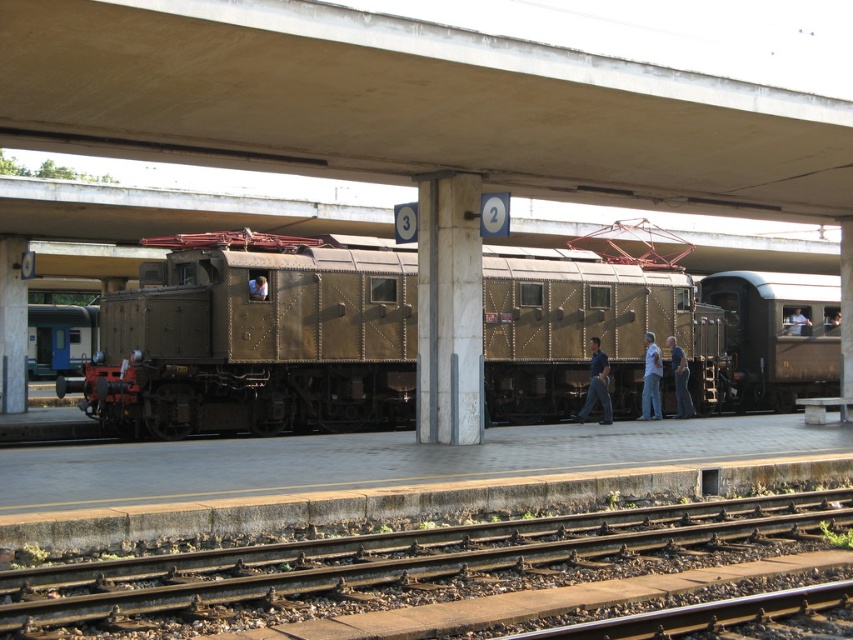
Question: Is rusty metal train at center positioned behind blue shirt at center?

Choices:
 (A) yes
 (B) no

Answer: (B)

Question: Does shiny brown train at right have a greater width compared to blue shirt at center?

Choices:
 (A) yes
 (B) no

Answer: (A)

Question: Which point is closer to the camera taking this photo?

Choices:
 (A) (260, 292)
 (B) (704, 99)
 (C) (776, 364)

Answer: (B)

Question: Does rusty metal train at center have a larger size compared to dark brown leather jacket at center?

Choices:
 (A) no
 (B) yes

Answer: (B)

Question: Which of the following is the farthest from the observer?

Choices:
 (A) metallic helmet at center
 (B) light blue jeans at center

Answer: (B)

Question: Which of the following is the closest to the observer?

Choices:
 (A) (590, 380)
 (B) (798, 344)
 (C) (538, 90)
 (D) (677, 346)

Answer: (C)